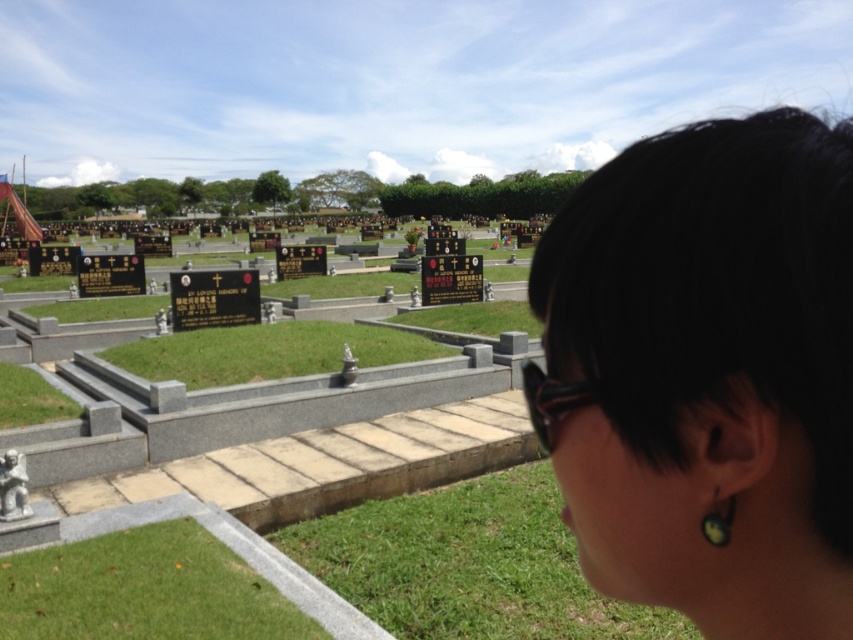
Which is behind, point (627, 326) or point (717, 538)?

The point (717, 538) is behind.

Does black hair at upper right have a larger size compared to green matte earring at lower right?

Indeed, black hair at upper right has a larger size compared to green matte earring at lower right.

In order to click on black hair at upper right in this screenshot , I will do `click(706, 372)`.